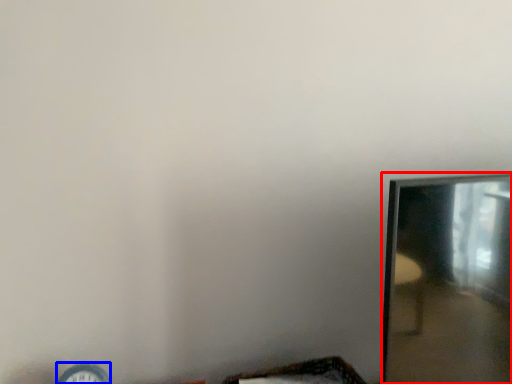
Question: Which of the following is the closest to the observer, mirror (highlighted by a red box) or clock (highlighted by a blue box)?

Choices:
 (A) mirror
 (B) clock

Answer: (A)